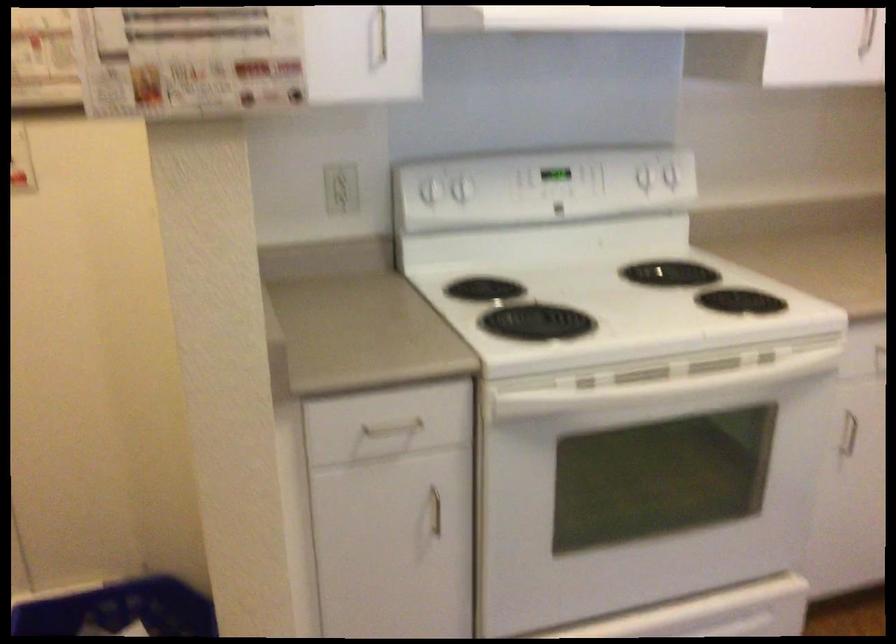
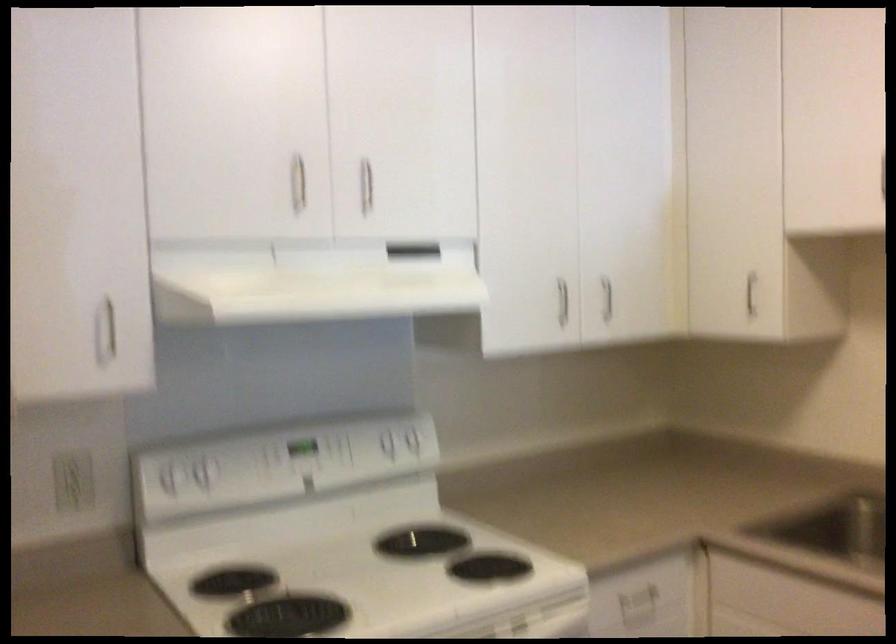
How did the camera likely rotate?

The rotation direction of the camera is right-up.